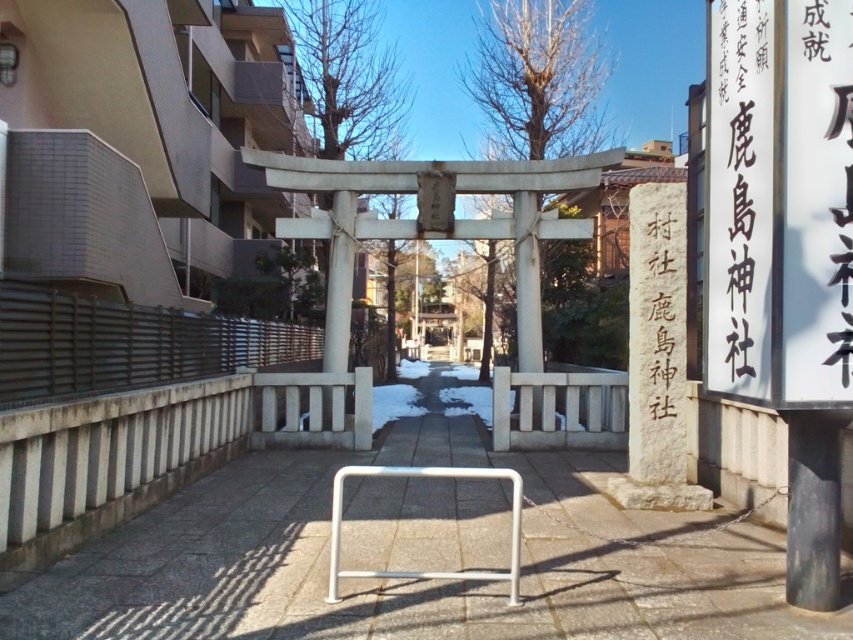
Question: Is black stone sign at center right to the left of white metallic bar at center from the viewer's perspective?

Choices:
 (A) yes
 (B) no

Answer: (B)

Question: Which point is closer to the camera taking this photo?

Choices:
 (A) (357, 476)
 (B) (640, 340)
 (C) (410, 600)

Answer: (C)

Question: Among these objects, which one is nearest to the camera?

Choices:
 (A) gray concrete pavement at center
 (B) white metallic bar at center
 (C) black stone sign at center right

Answer: (A)

Question: Does gray concrete pavement at center appear under white metallic bar at center?

Choices:
 (A) no
 (B) yes

Answer: (A)

Question: Which point is closer to the camera?

Choices:
 (A) (706, 612)
 (B) (341, 573)
 (C) (683, 260)

Answer: (A)

Question: Can you confirm if gray concrete pavement at center is positioned to the right of black stone sign at center right?

Choices:
 (A) yes
 (B) no

Answer: (B)